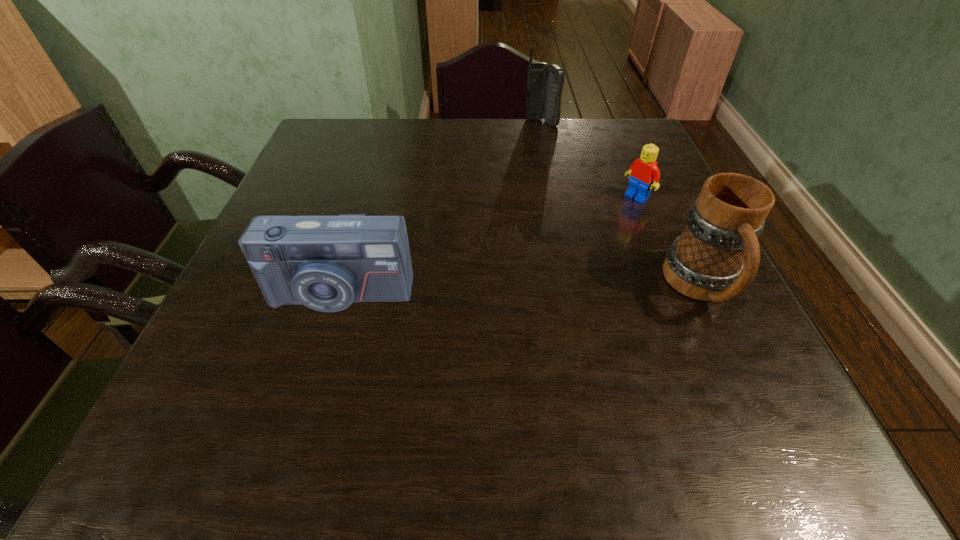
Where is `camera`? This screenshot has width=960, height=540. camera is located at coordinates pyautogui.click(x=326, y=263).

This screenshot has width=960, height=540. I want to click on mug, so click(706, 263).

The width and height of the screenshot is (960, 540). I want to click on Lego, so click(644, 174).

You are a GUI agent. You are given a task and a screenshot of the screen. Output one action in this format:
    pyautogui.click(x=<x>, y=<y>)
    Task: Click on the second farthest object
    Image resolution: width=960 pixels, height=540 pixels.
    Given the screenshot: What is the action you would take?
    pyautogui.click(x=644, y=174)

The width and height of the screenshot is (960, 540). I want to click on the second object from left to right, so click(544, 84).

Locate an element on the screen. This screenshot has width=960, height=540. the farthest object is located at coordinates (544, 84).

At what (x,y) coordinates should I click in order to perform the action: click on blank space located 0.160m on the lens of the leftmost object. Please return your answer as a coordinate pair (x, y). Image resolution: width=960 pixels, height=540 pixels. Looking at the image, I should click on (x=309, y=395).

Where is `blank area located 0.090m on the side of the mug with the handle`? The width and height of the screenshot is (960, 540). blank area located 0.090m on the side of the mug with the handle is located at coordinates click(x=741, y=371).

This screenshot has width=960, height=540. In order to click on vacant space located on the face of the shortest object in this screenshot , I will do `click(597, 225)`.

Locate an element on the screen. The height and width of the screenshot is (540, 960). vacant area located 0.050m on the face of the shortest object is located at coordinates (616, 212).